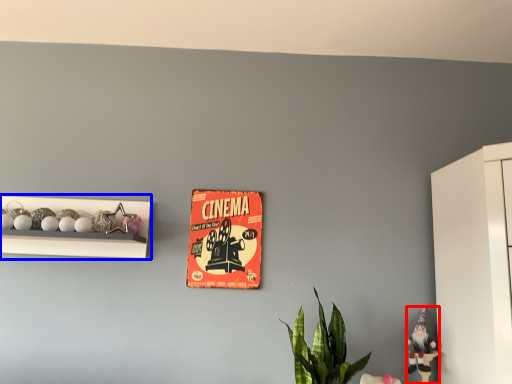
Question: Which of the following is the farthest to the observer, toy (highlighted by a red box) or shelf (highlighted by a blue box)?

Choices:
 (A) toy
 (B) shelf

Answer: (B)